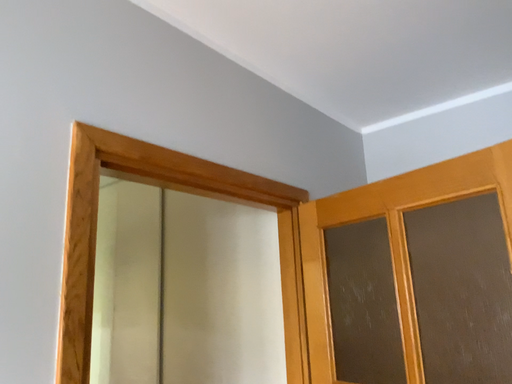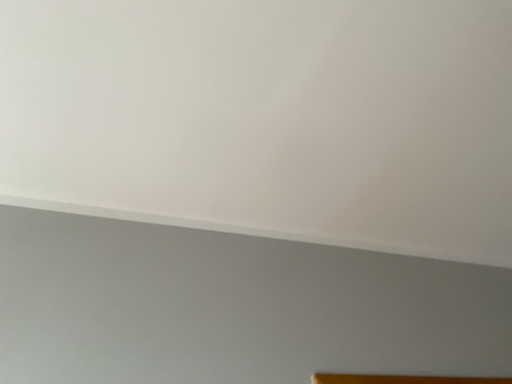
Question: How did the camera likely rotate when shooting the video?

Choices:
 (A) rotated left
 (B) rotated right

Answer: (A)